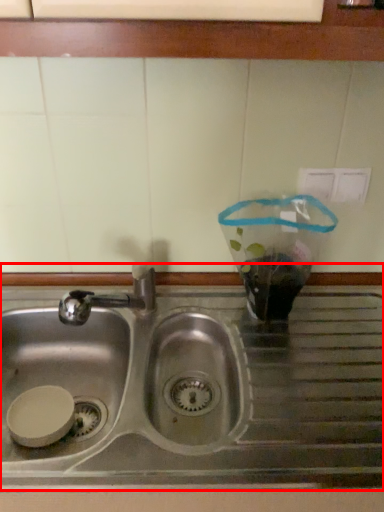
Question: In this image, where is sink (annotated by the red box) located relative to window sill?

Choices:
 (A) right
 (B) left

Answer: (A)